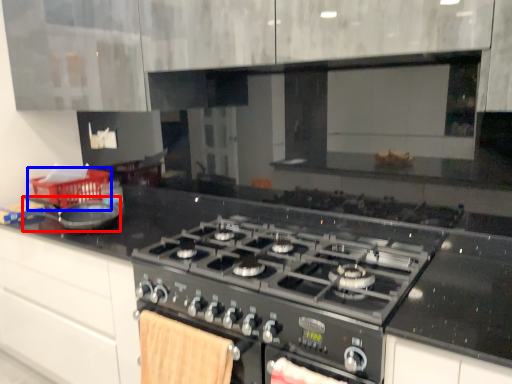
Question: Which object is further to the camera taking this photo, kitchen appliance (highlighted by a red box) or basket (highlighted by a blue box)?

Choices:
 (A) kitchen appliance
 (B) basket

Answer: (B)